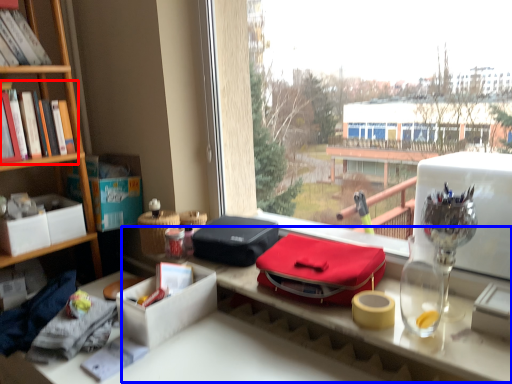
Question: Which object is further to the camera taking this photo, book (highlighted by a red box) or table (highlighted by a blue box)?

Choices:
 (A) book
 (B) table

Answer: (A)